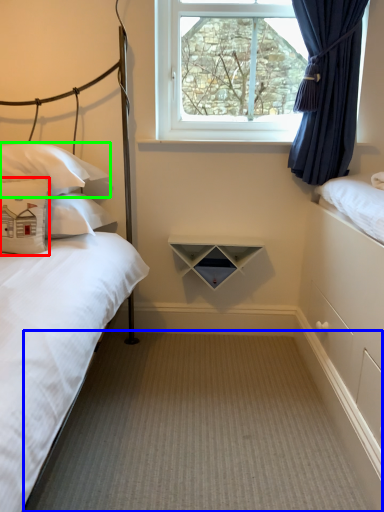
Question: Which object is positioned closest to pillow (highlighted by a red box)? Select from plain (highlighted by a blue box) and pillow (highlighted by a green box).

Choices:
 (A) plain
 (B) pillow

Answer: (B)